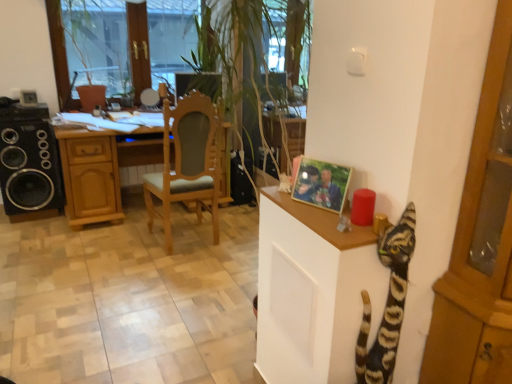
Where is `vacant area that is situated to the right of light brown wood chair at center`? This screenshot has height=384, width=512. vacant area that is situated to the right of light brown wood chair at center is located at coordinates (234, 251).